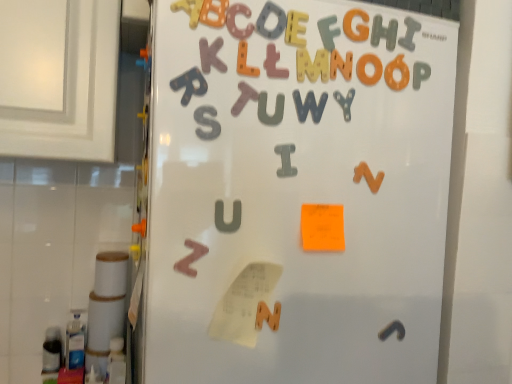
This screenshot has height=384, width=512. I want to click on gray matte letter i at upper center, the 9th letter in the left-to-right sequence, so click(x=409, y=33).

At what (x,y) coordinates should I click in order to perform the action: click on wooden letters at upper center. Please return your answer as a coordinate pair (x, y). This screenshot has width=512, height=384. Looking at the image, I should click on (293, 198).

Where is `matte pink letter at center, the 5th letter positioned from the right`? This screenshot has height=384, width=512. matte pink letter at center, the 5th letter positioned from the right is located at coordinates (274, 63).

At what (x,y) coordinates should I click in order to perform the action: click on wooden letter at upper center, which is the 9th letter from right to left. Please return your answer as a coordinate pair (x, y). Looking at the image, I should click on (189, 10).

What do you see at coordinates (266, 109) in the screenshot? I see `gray matte letter u at center, marked as the sixth letter in a right-to-left arrangement` at bounding box center [266, 109].

At what (x,y) coordinates should I click in order to perform the action: click on gray matte letter u at center, marked as the sixth letter in a right-to-left arrangement. Please return your answer as a coordinate pair (x, y). Looking at the image, I should click on (266, 109).

This screenshot has width=512, height=384. I want to click on gray matte letter i at upper center, the 9th letter in the left-to-right sequence, so click(409, 33).

Is matte wooden letter u at center, acting as the eighth letter starting from the right, looking in the opposite direction of wooden letter at upper center, which is the 9th letter from right to left?

That's not correct — matte wooden letter u at center, acting as the eighth letter starting from the right, is not looking away from wooden letter at upper center, which is the 9th letter from right to left.

From the image's perspective, is matte wooden letter u at center, acting as the eighth letter starting from the right, located above or below wooden letter at upper center, which is the 9th letter from right to left?

matte wooden letter u at center, acting as the eighth letter starting from the right, is situated lower than wooden letter at upper center, which is the 9th letter from right to left, in the image.

Considering the relative sizes of matte wooden letter u at center, positioned as the 2th letter in left-to-right order, and wooden letter at upper center, which is the 9th letter from right to left, in the image provided, is matte wooden letter u at center, positioned as the 2th letter in left-to-right order, thinner than wooden letter at upper center, which is the 9th letter from right to left,?

Correct, the width of matte wooden letter u at center, positioned as the 2th letter in left-to-right order, is less than that of wooden letter at upper center, which is the 9th letter from right to left.

Is matte wooden letter u at center, acting as the eighth letter starting from the right, closer to camera compared to wooden letter at upper center, which ranks as the first letter in left-to-right order?

No, matte wooden letter u at center, acting as the eighth letter starting from the right, is further to the viewer.

From the image's perspective, which is below, matte wooden letter r at upper center, which is counted as the 5th alphabet, starting from the right, or orange matte letter g at upper center, the 8th letter from the left?

matte wooden letter r at upper center, which is counted as the 5th alphabet, starting from the right, appears lower in the image.

Could you tell me if matte wooden letter r at upper center, the 1th alphabet from the front, is facing orange matte letter g at upper center, arranged as the 2th letter when viewed from the right?

No.

Between point (198, 79) and point (364, 40), which one is positioned in front?

Positioned in front is point (198, 79).

What's the angular difference between matte wooden letter r at upper center, positioned as the 1th alphabet in top-to-bottom order, and orange matte letter g at upper center, arranged as the 2th letter when viewed from the right,'s facing directions?

The angular difference between matte wooden letter r at upper center, positioned as the 1th alphabet in top-to-bottom order, and orange matte letter g at upper center, arranged as the 2th letter when viewed from the right, is 0.0202 degrees.

Which is more to the left, metallic silver letter y at upper center, which is the second alphabet from back to front, or gray matte letter u at center, marked as the sixth letter in a right-to-left arrangement?

Positioned to the left is gray matte letter u at center, marked as the sixth letter in a right-to-left arrangement.

Is metallic silver letter y at upper center, which appears as the 2th alphabet when viewed from the right, far away from gray matte letter u at center, marked as the sixth letter in a right-to-left arrangement?

metallic silver letter y at upper center, which appears as the 2th alphabet when viewed from the right, is near gray matte letter u at center, marked as the sixth letter in a right-to-left arrangement, not far away.

From the picture: How many degrees apart are the facing directions of metallic silver letter y at upper center, acting as the fourth alphabet starting from the left, and gray matte letter u at center, marked as the sixth letter in a right-to-left arrangement?

0.325 degrees separate the facing orientations of metallic silver letter y at upper center, acting as the fourth alphabet starting from the left, and gray matte letter u at center, marked as the sixth letter in a right-to-left arrangement.

Would you say metallic silver letter y at upper center, the fourth alphabet when ordered from bottom to top, is inside or outside gray matte letter u at center, marked as the sixth letter in a right-to-left arrangement?

metallic silver letter y at upper center, the fourth alphabet when ordered from bottom to top, is not enclosed by gray matte letter u at center, marked as the sixth letter in a right-to-left arrangement.

From the image's perspective, is orange matte letter at upper center, which is the 3th letter in right-to-left order, positioned above or below purple felt letter t at center, which ranks as the seventh letter in right-to-left order?

orange matte letter at upper center, which is the 3th letter in right-to-left order, is above purple felt letter t at center, which ranks as the seventh letter in right-to-left order.

At what (x,y) coordinates should I click in order to perform the action: click on the 2nd letter below the orange matte letter at upper center, the seventh letter positioned from the left (from a real-world perspective). Please return your answer as a coordinate pair (x, y). The image size is (512, 384). Looking at the image, I should click on (244, 98).

Considering the points (335, 69) and (242, 94), which point is behind, point (335, 69) or point (242, 94)?

The point (335, 69) is behind.

Is matte wooden letter u at center, positioned as the 2th letter in left-to-right order, spatially inside gray matte letter w at upper center, the third alphabet from the back, or outside of it?

matte wooden letter u at center, positioned as the 2th letter in left-to-right order, cannot be found inside gray matte letter w at upper center, the third alphabet from the back.

Does matte wooden letter u at center, positioned as the 2th letter in left-to-right order, have a greater height compared to gray matte letter w at upper center, the 3th alphabet when ordered from right to left?

No.

From a real-world perspective, who is located lower, matte wooden letter u at center, acting as the eighth letter starting from the right, or gray matte letter w at upper center, the third alphabet from the back?

From a 3D spatial view, matte wooden letter u at center, acting as the eighth letter starting from the right, is below.

Between point (221, 231) and point (297, 109), which one is positioned behind?

Point (297, 109)

Which object is more forward, brown wooden letter z at lower left, the fourth alphabet positioned from the right, or wooden letter at upper center, which ranks as the first letter in left-to-right order?

wooden letter at upper center, which ranks as the first letter in left-to-right order, is in front.

Does brown wooden letter z at lower left, the second alphabet from the left, turn towards wooden letter at upper center, which is the 9th letter from right to left?

No, brown wooden letter z at lower left, the second alphabet from the left, is not aimed at wooden letter at upper center, which is the 9th letter from right to left.

From the image's perspective, who appears lower, brown wooden letter z at lower left, the fourth alphabet positioned from the right, or wooden letter at upper center, which is the 9th letter from right to left?

brown wooden letter z at lower left, the fourth alphabet positioned from the right, appears lower in the image.

Is wooden letter at upper center, which ranks as the first letter in left-to-right order, inside brown wooden letter z at lower left, which appears as the fourth alphabet when viewed from the back?

Actually, wooden letter at upper center, which ranks as the first letter in left-to-right order, is outside brown wooden letter z at lower left, which appears as the fourth alphabet when viewed from the back.

Does orange matte letter g at upper center, the 8th letter from the left, appear on the right side of purple felt letter t at center, which ranks as the seventh letter in right-to-left order?

Yes, orange matte letter g at upper center, the 8th letter from the left, is to the right of purple felt letter t at center, which ranks as the seventh letter in right-to-left order.

Is purple felt letter t at center, the 3th letter positioned from the left, surrounded by orange matte letter g at upper center, arranged as the 2th letter when viewed from the right?

That's incorrect, purple felt letter t at center, the 3th letter positioned from the left, is not inside orange matte letter g at upper center, arranged as the 2th letter when viewed from the right.

Is orange matte letter g at upper center, the 8th letter from the left, closer to the viewer compared to purple felt letter t at center, which ranks as the seventh letter in right-to-left order?

No.

Locate an element on the screen. The height and width of the screenshot is (384, 512). the 2nd letter behind the wooden letter at upper center, which ranks as the first letter in left-to-right order, counting from the anchor's position is located at coordinates (223, 217).

From a real-world perspective, count 1st alphabets downward from the orange matte letter g at upper center, arranged as the 2th letter when viewed from the right, and point to it. Please provide its 2D coordinates.

[(190, 84)]

Considering their positions, is purple felt letter t at center, which ranks as the seventh letter in right-to-left order, positioned further to orange matte letter at upper center, the seventh letter positioned from the left, than orange matte letter n at upper right, which ranks as the 5th alphabet in left-to-right order?

orange matte letter n at upper right, which ranks as the 5th alphabet in left-to-right order, lies further to orange matte letter at upper center, the seventh letter positioned from the left, than the other object.

From the image, which object appears to be farther from matte wooden letter r at upper center, which is counted as the 5th alphabet, starting from the right, orange matte letter at upper center, which is the 3th letter in right-to-left order, or matte wooden letter at upper center, the fourth letter in the right-to-left sequence?

Based on the image, orange matte letter at upper center, which is the 3th letter in right-to-left order, appears to be further to matte wooden letter r at upper center, which is counted as the 5th alphabet, starting from the right.

From the image, which object appears to be nearer to metallic silver letter y at upper center, which is counted as the 4th alphabet, starting from the front, orange matte letter at upper center, which is the 3th letter in right-to-left order, or matte wooden letter at upper center, the 6th letter when ordered from left to right?

orange matte letter at upper center, which is the 3th letter in right-to-left order, is positioned closer to the anchor metallic silver letter y at upper center, which is counted as the 4th alphabet, starting from the front.

Based on their spatial positions, is matte pink letter at center, the 5th letter positioned from the left, or orange matte letter at upper center, which is the 3th letter in right-to-left order, closer to gray matte letter u at center, marked as the sixth letter in a right-to-left arrangement?

matte pink letter at center, the 5th letter positioned from the left, lies closer to gray matte letter u at center, marked as the sixth letter in a right-to-left arrangement, than the other object.

Looking at the image, which one is located closer to matte wooden letter r at upper center, positioned as the 1th alphabet in top-to-bottom order, wooden letters at upper center or matte wooden letter at upper center, the 6th letter when ordered from left to right?

Among the two, matte wooden letter at upper center, the 6th letter when ordered from left to right, is located nearer to matte wooden letter r at upper center, positioned as the 1th alphabet in top-to-bottom order.

Estimate the real-world distances between objects in this image. Which object is further from orange matte letter n at upper right, marked as the fifth alphabet in a front-to-back arrangement, gray matte letter u at center, marked as the sixth letter in a right-to-left arrangement, or purple felt letter t at center, the 3th letter positioned from the left?

Based on the image, purple felt letter t at center, the 3th letter positioned from the left, appears to be further to orange matte letter n at upper right, marked as the fifth alphabet in a front-to-back arrangement.

Considering their positions, is matte wooden letter r at upper center, marked as the 1th alphabet in a left-to-right arrangement, positioned closer to purple felt letter t at center, the 3th letter positioned from the left, than gray matte letter u at center, marked as the sixth letter in a right-to-left arrangement?

Based on the image, gray matte letter u at center, marked as the sixth letter in a right-to-left arrangement, appears to be nearer to purple felt letter t at center, the 3th letter positioned from the left.

When comparing their distances from gray matte letter w at upper center, positioned as the third alphabet in left-to-right order, does brown wooden letter z at lower left, the fourth alphabet positioned from the right, or wooden letter at upper center, which is the 9th letter from right to left, seem closer?

Among the two, wooden letter at upper center, which is the 9th letter from right to left, is located nearer to gray matte letter w at upper center, positioned as the third alphabet in left-to-right order.

Identify the location of letter between gray matte letter w at upper center, the third alphabet from the back, and matte wooden letter u at center, positioned as the 2th letter in left-to-right order, in the vertical direction. 266,109.

I want to click on letter between purple felt letter t at center, the 3th letter positioned from the left, and matte wooden letter u at center, acting as the eighth letter starting from the right, in the vertical direction, so click(x=266, y=109).

The height and width of the screenshot is (384, 512). I want to click on alphabet located between matte pink letter at center, the 5th letter positioned from the left, and metallic silver letter y at upper center, the fourth alphabet when ordered from bottom to top, in the left-right direction, so click(x=309, y=106).

Where is `alphabet between wooden letter at upper center, which ranks as the first letter in left-to-right order, and orange matte letter at upper center, which is the 3th letter in right-to-left order, in the horizontal direction`? The image size is (512, 384). alphabet between wooden letter at upper center, which ranks as the first letter in left-to-right order, and orange matte letter at upper center, which is the 3th letter in right-to-left order, in the horizontal direction is located at coordinates (309, 106).